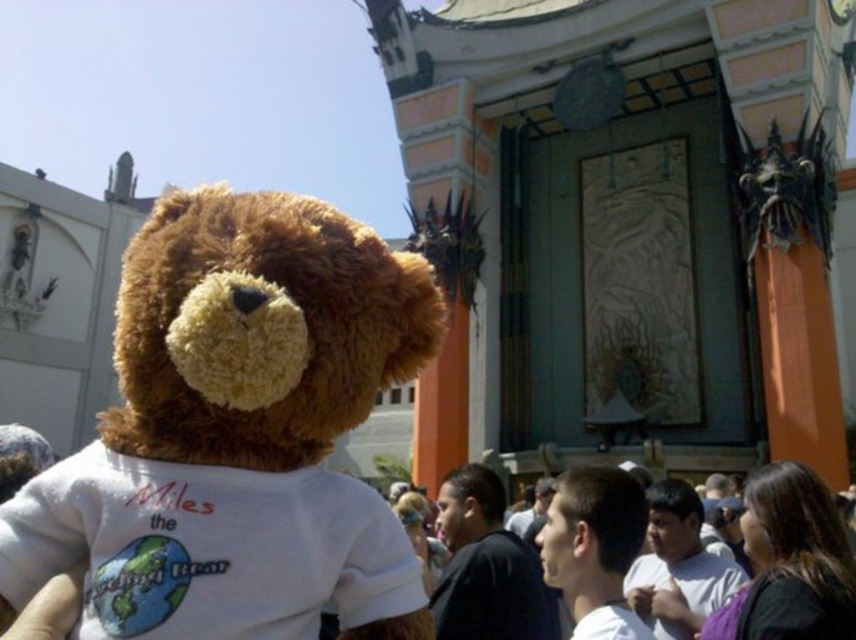
Question: Is soft brown teddy bear at center smaller than dark brown hair at center?

Choices:
 (A) yes
 (B) no

Answer: (B)

Question: Which point is farther from the camera taking this photo?

Choices:
 (A) (230, 307)
 (B) (782, 509)

Answer: (B)

Question: Does soft brown teddy bear at center have a smaller size compared to dark brown hair at center?

Choices:
 (A) no
 (B) yes

Answer: (A)

Question: Among these points, which one is nearest to the camera?

Choices:
 (A) (46, 509)
 (B) (819, 628)

Answer: (A)

Question: In this image, where is soft brown teddy bear at center located relative to dark brown hair at center?

Choices:
 (A) right
 (B) left

Answer: (B)